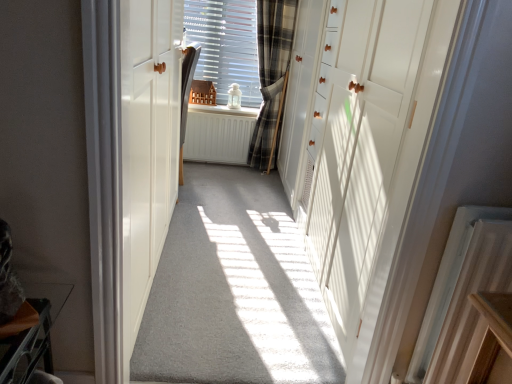
The height and width of the screenshot is (384, 512). Find the location of `white glossy cabinet at right, which is counted as the second door, starting from the left`. white glossy cabinet at right, which is counted as the second door, starting from the left is located at coordinates (361, 146).

What do you see at coordinates (271, 75) in the screenshot? Image resolution: width=512 pixels, height=384 pixels. I see `plaid fabric curtain at center` at bounding box center [271, 75].

Find the location of a particular element. Image resolution: width=512 pixels, height=384 pixels. white glossy cabinet at right, which is counted as the second door, starting from the left is located at coordinates (361, 146).

Relative to white painted wood at center, is white wood door at left, the first door from the left, in front or behind?

Visually, white wood door at left, the first door from the left, is located in front of white painted wood at center.

Can you tell me how much white wood door at left, the 2th door when ordered from right to left, and white painted wood at center differ in facing direction?

90 degrees separate the facing orientations of white wood door at left, the 2th door when ordered from right to left, and white painted wood at center.

Looking at this image, from the image's perspective, is white wood door at left, the first door from the left, above or below white painted wood at center?

Clearly, from the image's perspective, white wood door at left, the first door from the left, is below white painted wood at center.

Considering the positions of points (112, 135) and (193, 108), is point (112, 135) farther from camera compared to point (193, 108)?

No, it is in front of (193, 108).

Is white plastic radiator at lower right, the 1th radiator in the bottom-to-top sequence, in front of or behind plaid fabric at center in the image?

In the image, white plastic radiator at lower right, the 1th radiator in the bottom-to-top sequence, appears in front of plaid fabric at center.

Could you tell me if white plastic radiator at lower right, the 2th radiator from the back, is turned towards plaid fabric at center?

No, white plastic radiator at lower right, the 2th radiator from the back, is not turned towards plaid fabric at center.

Between white plastic radiator at lower right, the 2th radiator in the left-to-right sequence, and plaid fabric at center, which one has larger width?

With larger width is white plastic radiator at lower right, the 2th radiator in the left-to-right sequence.

From a real-world perspective, starting from the plaid fabric at center, which radiator is the 2nd one below it? Please provide its 2D coordinates.

[(218, 134)]

Is plaid fabric at center facing away from white matte radiator at center, acting as the second radiator starting from the bottom?

No, plaid fabric at center's orientation is not away from white matte radiator at center, acting as the second radiator starting from the bottom.

Which is less distant, [246,11] or [233,128]?

Point [246,11]

Can you confirm if plaid fabric at center is bigger than white wood door at left, the 2th door when ordered from right to left?

Incorrect, plaid fabric at center is not larger than white wood door at left, the 2th door when ordered from right to left.

Can you confirm if plaid fabric at center is wider than white wood door at left, the first door from the left?

No, plaid fabric at center is not wider than white wood door at left, the first door from the left.

Considering the positions of objects plaid fabric at center and white wood door at left, the first door from the left, in the image provided, who is behind, plaid fabric at center or white wood door at left, the first door from the left,?

plaid fabric at center is further from the camera.

Does white plastic radiator at lower right, the 1th radiator in the bottom-to-top sequence, have a smaller size compared to plaid fabric curtain at center?

Yes, white plastic radiator at lower right, the 1th radiator in the bottom-to-top sequence, is smaller than plaid fabric curtain at center.

Is white plastic radiator at lower right, the 2th radiator from the back, turned away from plaid fabric curtain at center?

Absolutely, white plastic radiator at lower right, the 2th radiator from the back, is directed away from plaid fabric curtain at center.

Is point (436, 303) more distant than point (284, 32)?

That is False.

Is white plastic radiator at lower right, the 2th radiator from the back, next to plaid fabric curtain at center?

They are not placed beside each other.

Would you say white wood door at left, the 2th door when ordered from right to left, is inside or outside plaid fabric at center?

The correct answer is: outside.

Considering the relative positions of white wood door at left, the first door from the left, and plaid fabric at center in the image provided, is white wood door at left, the first door from the left, to the left of plaid fabric at center from the viewer's perspective?

Correct, you'll find white wood door at left, the first door from the left, to the left of plaid fabric at center.

Which object is thinner, white wood door at left, the 2th door when ordered from right to left, or plaid fabric at center?

plaid fabric at center.

How many degrees apart are the facing directions of white wood door at left, the first door from the left, and plaid fabric at center?

90 degrees.

Between plaid fabric at center and white plastic radiator at lower right, the 1th radiator in the bottom-to-top sequence, which one has smaller size?

Smaller between the two is white plastic radiator at lower right, the 1th radiator in the bottom-to-top sequence.

In the image, is plaid fabric at center positioned in front of or behind white plastic radiator at lower right, acting as the 1th radiator starting from the front?

In the image, plaid fabric at center appears behind white plastic radiator at lower right, acting as the 1th radiator starting from the front.

What's the angular difference between plaid fabric at center and white plastic radiator at lower right, the 1th radiator in the bottom-to-top sequence,'s facing directions?

The facing directions of plaid fabric at center and white plastic radiator at lower right, the 1th radiator in the bottom-to-top sequence, are 1.47 degrees apart.

Is plaid fabric at center not close to white plastic radiator at lower right, arranged as the second radiator when viewed from the top?

Yes, plaid fabric at center and white plastic radiator at lower right, arranged as the second radiator when viewed from the top, are quite far apart.

The width and height of the screenshot is (512, 384). I want to click on window sill on the right of the white wood door at left, the first door from the left, so click(224, 110).

Locate an element on the screen. This screenshot has width=512, height=384. window positioned vertically above the white plastic radiator at lower right, arranged as the second radiator when viewed from the top (from a real-world perspective) is located at coordinates (226, 46).

Consider the image. Looking at the image, which one is located closer to white wood door at left, the first door from the left, plaid fabric at center or white painted wood at center?

plaid fabric at center is closer to white wood door at left, the first door from the left.

From the image, which object appears to be nearer to white matte radiator at center, marked as the first radiator in a left-to-right arrangement, plaid fabric at center or plaid fabric curtain at center?

Based on the image, plaid fabric curtain at center appears to be nearer to white matte radiator at center, marked as the first radiator in a left-to-right arrangement.

Considering their positions, is plaid fabric at center positioned further to white glossy cabinet at right, the first door from the right, than white painted wood at center?

The object further to white glossy cabinet at right, the first door from the right, is white painted wood at center.

Which object lies further to the anchor point plaid fabric curtain at center, white plastic radiator at lower right, the 2th radiator from the back, or white wood door at left, the first door from the left?

Based on the image, white plastic radiator at lower right, the 2th radiator from the back, appears to be further to plaid fabric curtain at center.

When comparing their distances from white painted wood at center, does white matte radiator at center, marked as the first radiator in a left-to-right arrangement, or plaid fabric at center seem further?

plaid fabric at center lies further to white painted wood at center than the other object.

Estimate the real-world distances between objects in this image. Which object is closer to plaid fabric curtain at center, white wood door at left, the first door from the left, or plaid fabric at center?

Among the two, plaid fabric at center is located nearer to plaid fabric curtain at center.

Looking at the image, which one is located further to plaid fabric curtain at center, white matte radiator at center, placed as the 2th radiator when sorted from front to back, or plaid fabric at center?

The object further to plaid fabric curtain at center is plaid fabric at center.

Looking at the image, which one is located closer to white painted wood at center, white matte radiator at center, marked as the 2th radiator in a right-to-left arrangement, or white plastic radiator at lower right, acting as the 1th radiator starting from the front?

white matte radiator at center, marked as the 2th radiator in a right-to-left arrangement.

Where is `radiator between white glossy cabinet at right, the first door from the right, and plaid fabric at center from front to back`? This screenshot has width=512, height=384. radiator between white glossy cabinet at right, the first door from the right, and plaid fabric at center from front to back is located at coordinates pos(447,283).

Where is `door located between white wood door at left, the 2th door when ordered from right to left, and white plastic radiator at lower right, arranged as the second radiator when viewed from the top, in the left-right direction`? The height and width of the screenshot is (384, 512). door located between white wood door at left, the 2th door when ordered from right to left, and white plastic radiator at lower right, arranged as the second radiator when viewed from the top, in the left-right direction is located at coordinates (361, 146).

Identify the location of window between white glossy cabinet at right, which is counted as the second door, starting from the left, and white painted wood at center from front to back. (226, 46).

Locate an element on the screen. This screenshot has width=512, height=384. radiator located between white glossy cabinet at right, which is counted as the second door, starting from the left, and plaid fabric curtain at center in the depth direction is located at coordinates (447, 283).